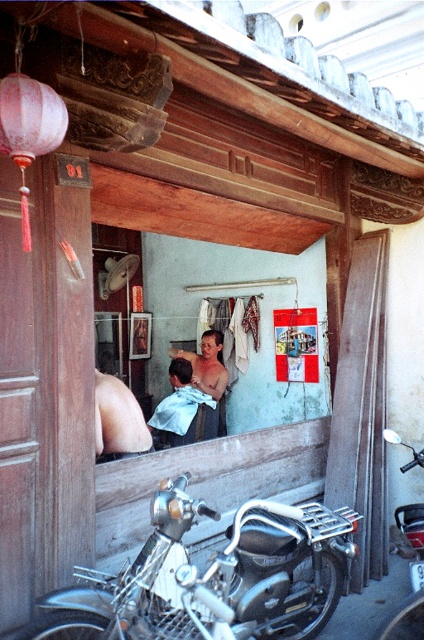
You are a customer in this shop and want to know which object is smaller between the shiny chrome motorcycle at lower right and the shiny metallic hairdryer at center. Can you help me?

The shiny chrome motorcycle at lower right is smaller than the shiny metallic hairdryer at center according to the description.

Looking at this image, you are a customer entering the shop and see the shiny chrome motorcycle at lower left and the shiny chrome motorcycle at lower right. Which motorcycle is positioned higher up in the image?

The shiny chrome motorcycle at lower left is positioned higher up in the image because it is above the shiny chrome motorcycle at lower right.